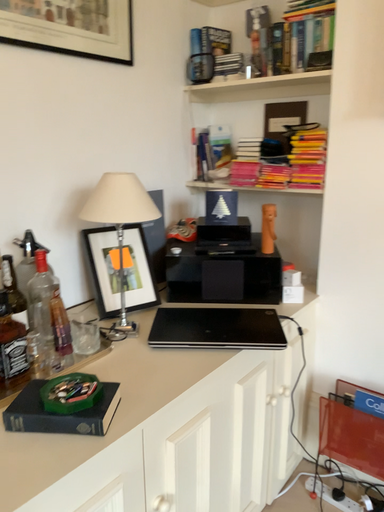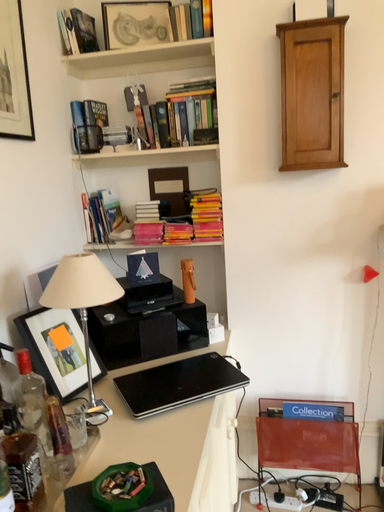
Question: How did the camera likely rotate when shooting the video?

Choices:
 (A) rotated upward
 (B) rotated downward

Answer: (A)